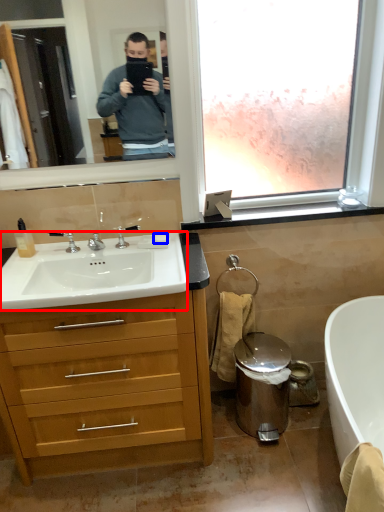
Question: Which object is closer to the camera taking this photo, sink (highlighted by a red box) or soap (highlighted by a blue box)?

Choices:
 (A) sink
 (B) soap

Answer: (A)